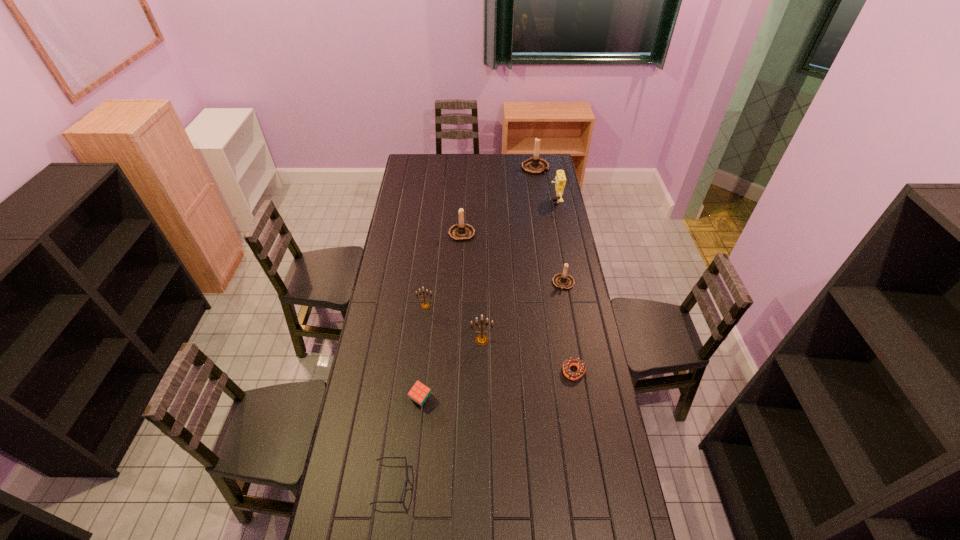
Find the location of a particular element. the tallest candelabrum is located at coordinates (535, 166).

Find the location of a particular element. The height and width of the screenshot is (540, 960). the farthest candelabrum is located at coordinates click(535, 166).

Locate an element on the screen. This screenshot has height=540, width=960. sponge is located at coordinates (560, 179).

Identify the location of the sixth farthest object. This screenshot has height=540, width=960. (481, 340).

This screenshot has height=540, width=960. Find the location of `the nearer gold candelabrum`. the nearer gold candelabrum is located at coordinates (481, 340).

This screenshot has width=960, height=540. In order to click on the leftmost brown candle holder in this screenshot , I will do `click(461, 232)`.

Image resolution: width=960 pixels, height=540 pixels. What are the coordinates of `the second smallest brown candle holder` in the screenshot? It's located at (461, 232).

Locate an element on the screen. This screenshot has height=540, width=960. the smallest brown candle holder is located at coordinates (562, 281).

Identify the location of the third nearest candelabrum. The height and width of the screenshot is (540, 960). (562, 281).

In order to click on the leftmost candelabrum in this screenshot , I will do `click(425, 305)`.